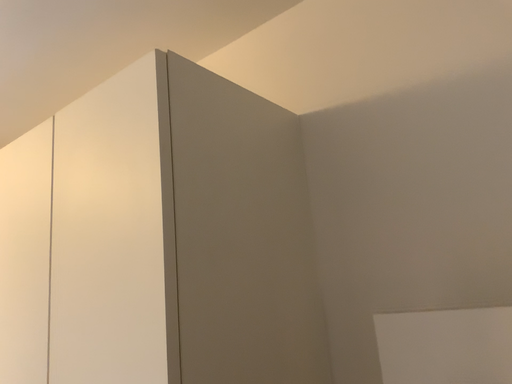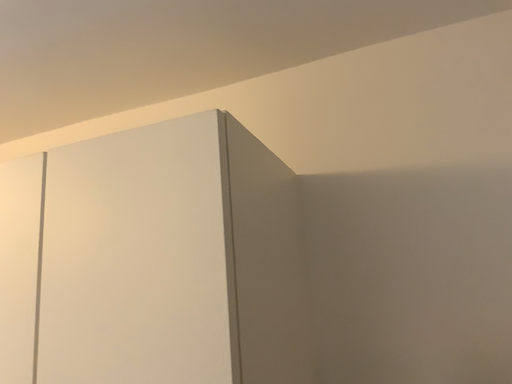
Question: Which way did the camera rotate in the video?

Choices:
 (A) rotated right
 (B) rotated left

Answer: (A)